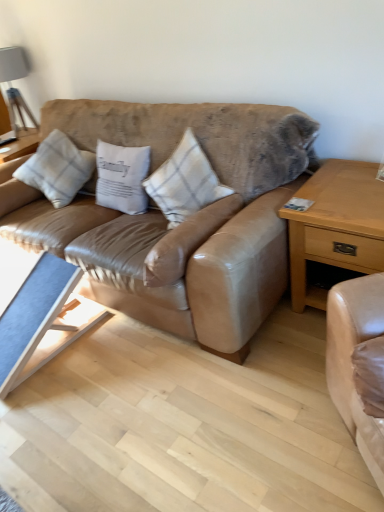
Locate an element on the screen. The width and height of the screenshot is (384, 512). vacant space to the left of light brown wood nightstand at right is located at coordinates (285, 337).